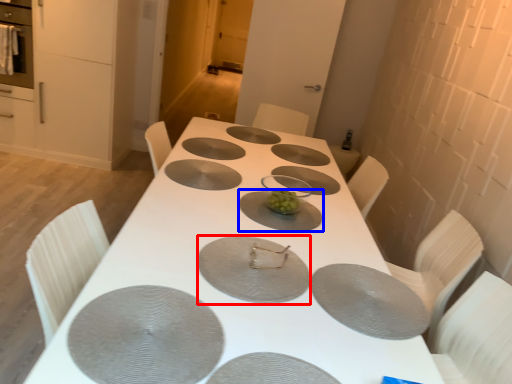
Question: Which object appears closest to the camera in this image, pizza pan (highlighted by a red box) or platter (highlighted by a blue box)?

Choices:
 (A) pizza pan
 (B) platter

Answer: (A)